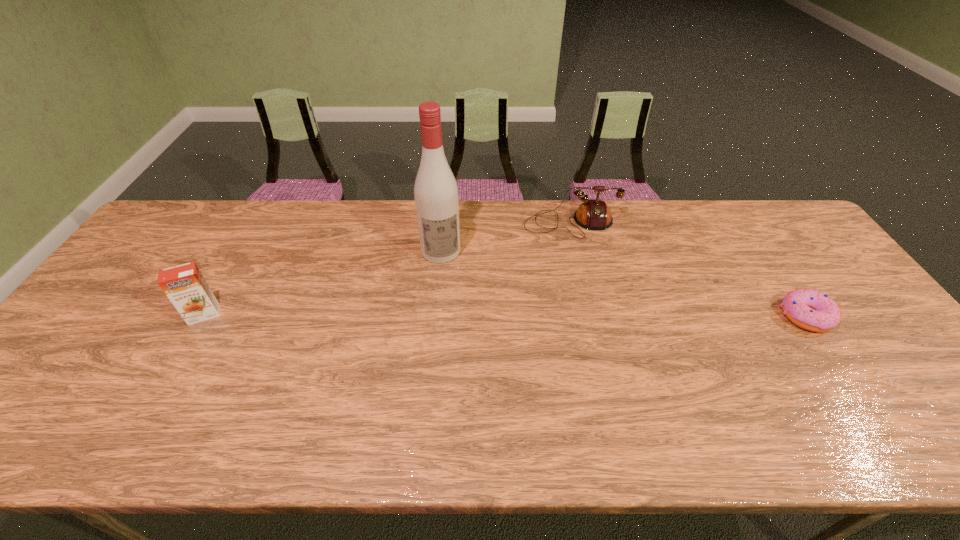
You are a GUI agent. You are given a task and a screenshot of the screen. Output one action in this format:
    pyautogui.click(x=<x>, y=<y>)
    Task: Click on the free space located on the label of the alcohol
    
    Given the screenshot: What is the action you would take?
    pyautogui.click(x=448, y=293)

Find the location of `vacant region located 0.200m on the label of the alcohol`. vacant region located 0.200m on the label of the alcohol is located at coordinates (453, 315).

This screenshot has height=540, width=960. Identify the location of free region located on the label of the alcohol. (452, 309).

Identify the location of free space located 0.120m on the rotary dial of the telephone. This screenshot has height=540, width=960. (579, 266).

Where is `vacant space located on the rotary dial of the telephone`? vacant space located on the rotary dial of the telephone is located at coordinates (593, 342).

Find the location of a particular element. This screenshot has height=540, width=960. blank space located on the rotary dial of the telephone is located at coordinates (592, 336).

Where is `alcohol at the far edge`? Image resolution: width=960 pixels, height=540 pixels. alcohol at the far edge is located at coordinates (436, 198).

You are a GUI agent. You are given a task and a screenshot of the screen. Output one action in this format:
    pyautogui.click(x=<x>, y=<y>)
    Task: Click on the telephone that is positioned at the far edge
    
    Given the screenshot: What is the action you would take?
    [593, 214]

Locate an element on the screen. object situated at the right edge is located at coordinates (812, 310).

I want to click on vacant area at the far edge, so click(645, 242).